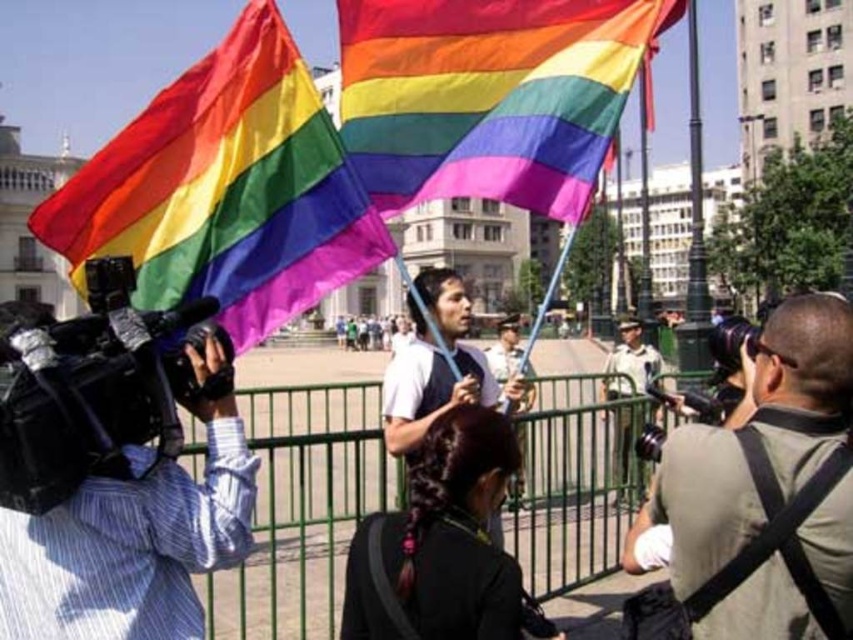
You are a photographer at the event and need to know which camera is lower. Can you tell me which one is positioned lower between the matte black camera at center and the black plastic video camera at center?

The matte black camera at center is positioned below the black plastic video camera at center, so the matte black camera at center is lower.

You are a photographer at the event and want to position your new camera between the two existing cameras. The matte black camera at center and the metallic silver camera at center are already placed. Which side should you place your new camera to ensure it is between them?

The matte black camera at center is to the left of the metallic silver camera at center, so placing your new camera between them would require positioning it to the right of the matte black camera at center and to the left of the metallic silver camera at center.

You are a photographer standing at the point marked as point (788, 385). You want to take a photo of the rainbow flags in the middle ground. The camera you have can focus on subjects within 150 feet. Will your camera be able to focus on the rainbow flags?

The point (788, 385) is 149.14 feet from the camera, which is within the camera focus range of 150 feet. Yes, the camera will be able to focus on the rainbow flags.